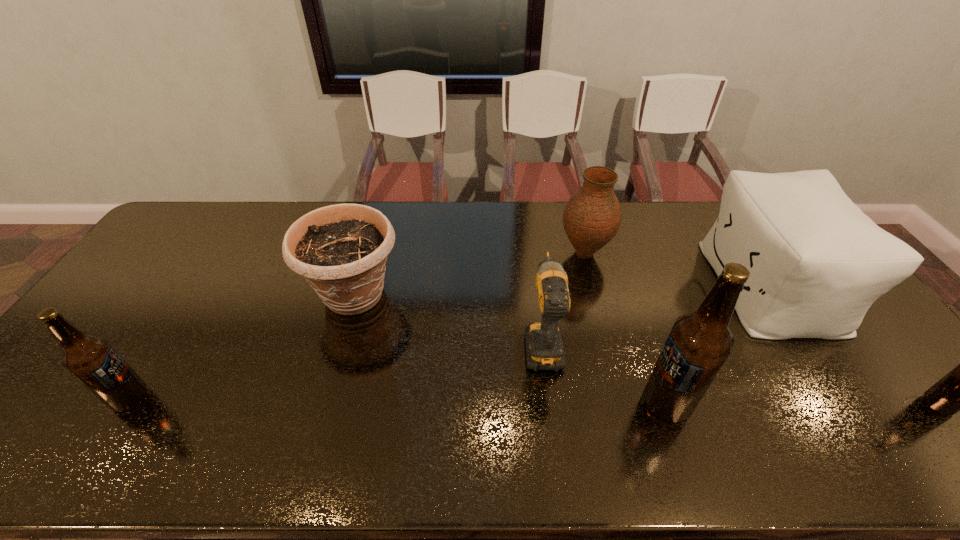
This screenshot has height=540, width=960. Find the location of `vacant area situated on the label of the tallest object`. vacant area situated on the label of the tallest object is located at coordinates (614, 403).

Locate an element on the screen. This screenshot has height=540, width=960. free space located on the label of the tallest object is located at coordinates (564, 403).

You are a GUI agent. You are given a task and a screenshot of the screen. Output one action in this format:
    pyautogui.click(x=<x>, y=<y>)
    Task: Click on the vacant space located 0.090m on the side of the cushion with the smiley face
    The height and width of the screenshot is (540, 960).
    Given the screenshot: What is the action you would take?
    pyautogui.click(x=686, y=285)

Identify the location of vacant space located on the side of the cushion with the smiley face. (631, 285).

The width and height of the screenshot is (960, 540). Find the location of `free region located 0.390m on the side of the cushion with the smiley face`. free region located 0.390m on the side of the cushion with the smiley face is located at coordinates (588, 285).

The image size is (960, 540). Find the location of `free space located 0.270m on the right of the vase`. free space located 0.270m on the right of the vase is located at coordinates pos(692,253).

Where is `blank space located with the drill bit of the drill facing forward`? The width and height of the screenshot is (960, 540). blank space located with the drill bit of the drill facing forward is located at coordinates (533, 268).

This screenshot has height=540, width=960. I want to click on vacant space positioned with the drill bit of the drill facing forward, so click(x=528, y=226).

I want to click on free spot located with the drill bit of the drill facing forward, so click(532, 260).

Where is `vacant space located on the back of the second object from left to right`? vacant space located on the back of the second object from left to right is located at coordinates (370, 242).